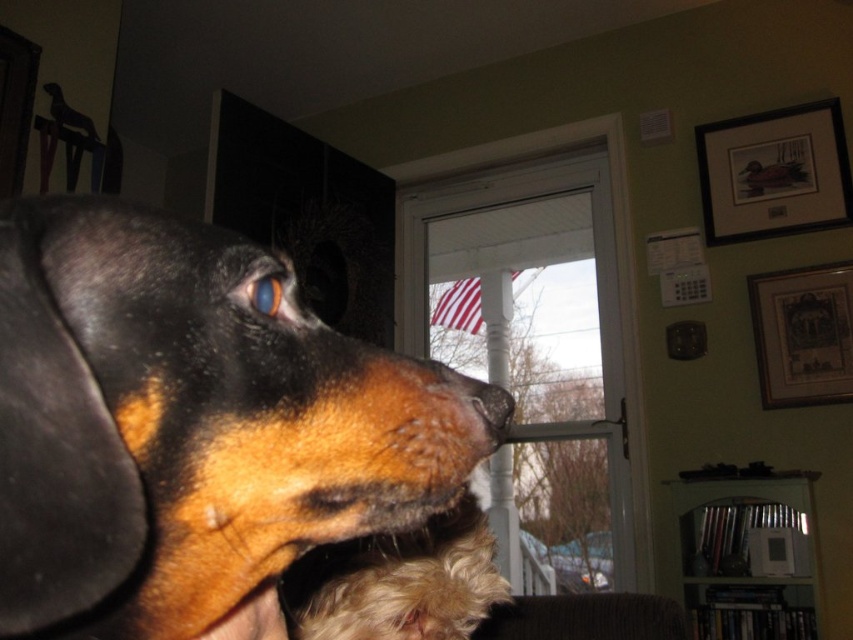
Question: Can you confirm if brown fur dog at center is positioned to the right of black matte nose at center?

Choices:
 (A) no
 (B) yes

Answer: (A)

Question: Based on their relative distances, which object is farther from the black matte nose at center?

Choices:
 (A) blue glossy eye at upper center
 (B) brown fur dog at center
 (C) clear glass window at center

Answer: (C)

Question: Among these objects, which one is farthest from the camera?

Choices:
 (A) black matte nose at center
 (B) blue glossy eye at upper center
 (C) brown fur dog at center

Answer: (A)

Question: Which point is closer to the camera?

Choices:
 (A) blue glossy eye at upper center
 (B) clear glass window at center
 (C) black matte nose at center
 (D) brown fur dog at center

Answer: (D)

Question: Can you confirm if clear glass window at center is positioned to the right of black matte nose at center?

Choices:
 (A) no
 (B) yes

Answer: (B)

Question: Can you confirm if clear glass window at center is smaller than blue glossy eye at upper center?

Choices:
 (A) no
 (B) yes

Answer: (A)